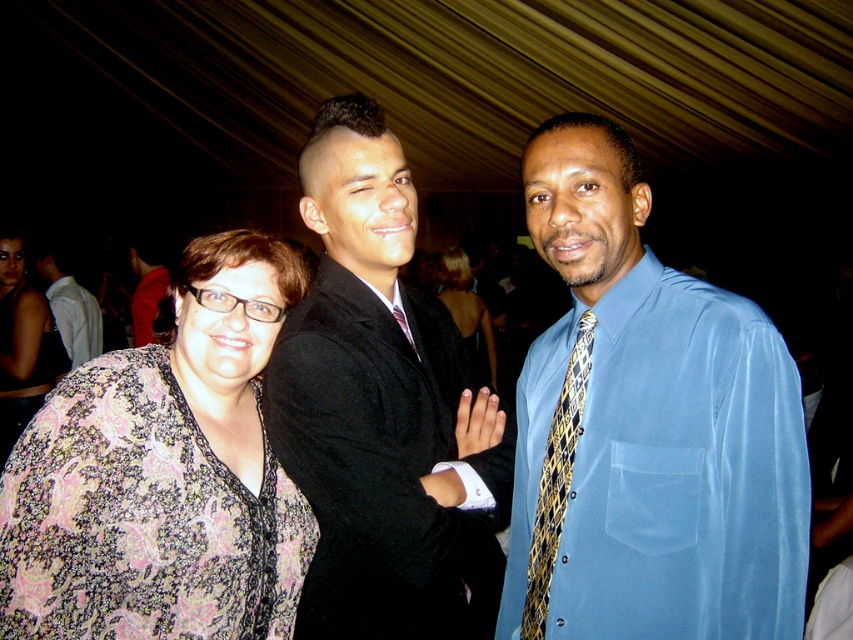
You are standing in front of the group photo taken at a formal event under a tent. You notice two points marked in the image. The first point is at coordinates point (306, 348) and the second is at point (149, 326). Based on their positions, which point is nearer to you?

Point (306, 348) is closer to the viewer than point (149, 326).

You are a photographer at a formal event and need to adjust the lighting to ensure both the shiny black suit at center and the shiny black dress at center are equally visible. Given their height difference, which one might require more upward or downward angle adjustments?

The shiny black suit at center is taller than the shiny black dress at center, so the photographer might need to adjust the camera angle slightly upward for the shiny black suit at center and downward for the shiny black dress at center to ensure both are equally visible.

You are a photographer at the event and need to adjust the lighting to ensure both the shiny black suit at center and the shiny black dress at center are well illuminated. Given their widths, which one might require a wider light spread to cover its entire surface?

The shiny black suit at center has a greater width than the shiny black dress at center, so it would need a wider light spread to fully illuminate its surface.